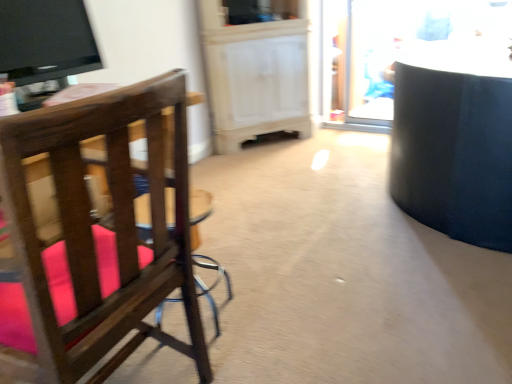
Question: Can you confirm if wooden chair with pink cushions at left is thinner than wooden bar stool at center?

Choices:
 (A) yes
 (B) no

Answer: (B)

Question: Considering the relative positions of wooden chair with pink cushions at left and wooden bar stool at center in the image provided, is wooden chair with pink cushions at left to the left of wooden bar stool at center from the viewer's perspective?

Choices:
 (A) yes
 (B) no

Answer: (A)

Question: From a real-world perspective, is wooden chair with pink cushions at left located beneath wooden bar stool at center?

Choices:
 (A) no
 (B) yes

Answer: (A)

Question: Can you confirm if wooden chair with pink cushions at left is taller than wooden bar stool at center?

Choices:
 (A) no
 (B) yes

Answer: (B)

Question: Does wooden chair with pink cushions at left have a greater width compared to wooden bar stool at center?

Choices:
 (A) yes
 (B) no

Answer: (A)

Question: Is wooden bar stool at center inside wooden chair with pink cushions at left?

Choices:
 (A) no
 (B) yes

Answer: (A)

Question: Can you confirm if transparent glass door at upper right is shorter than wooden chair with pink cushions at left?

Choices:
 (A) yes
 (B) no

Answer: (B)

Question: Is the position of transparent glass door at upper right less distant than that of wooden chair with pink cushions at left?

Choices:
 (A) yes
 (B) no

Answer: (B)

Question: Does transparent glass door at upper right have a lesser width compared to wooden chair with pink cushions at left?

Choices:
 (A) no
 (B) yes

Answer: (B)

Question: From a real-world perspective, is transparent glass door at upper right positioned under wooden chair with pink cushions at left based on gravity?

Choices:
 (A) yes
 (B) no

Answer: (B)

Question: Considering the relative positions of transparent glass door at upper right and wooden chair with pink cushions at left in the image provided, is transparent glass door at upper right to the right of wooden chair with pink cushions at left from the viewer's perspective?

Choices:
 (A) yes
 (B) no

Answer: (A)

Question: Is transparent glass door at upper right not inside wooden chair with pink cushions at left?

Choices:
 (A) no
 (B) yes

Answer: (B)

Question: Is transparent glass door at upper right inside wooden bar stool at center?

Choices:
 (A) no
 (B) yes

Answer: (A)